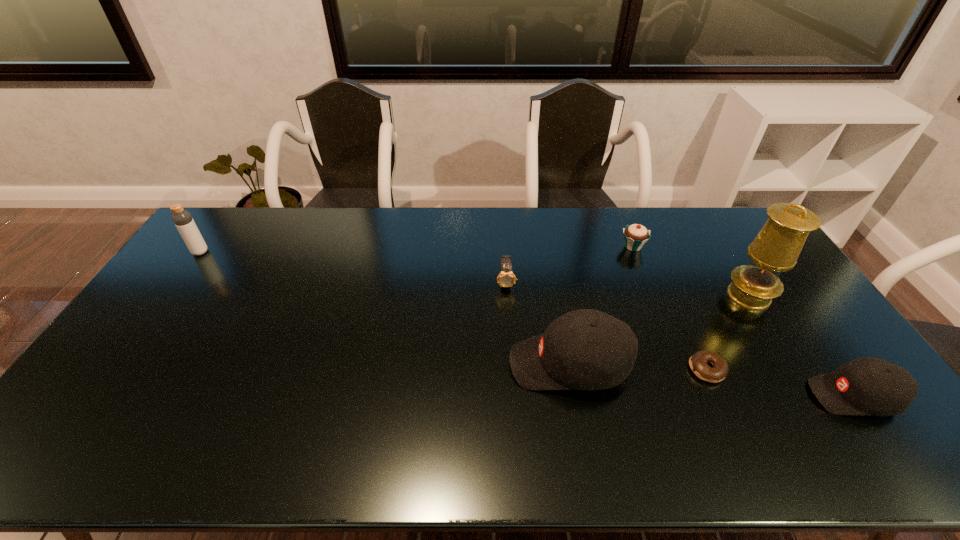
Find the location of a particular element. object that is at the far edge is located at coordinates (635, 235).

Identify the location of object at the left edge. The image size is (960, 540). (182, 219).

Find the location of a particular element. The image size is (960, 540). baseball cap that is at the right edge is located at coordinates (866, 386).

Where is `oil lamp situated at the right edge`? The image size is (960, 540). oil lamp situated at the right edge is located at coordinates (776, 248).

The height and width of the screenshot is (540, 960). In order to click on object that is at the near right corner in this screenshot , I will do `click(866, 386)`.

Locate an element on the screen. vacant space at the far edge is located at coordinates (656, 235).

Identify the location of blank space at the near edge. (249, 395).

You are a GUI agent. You are given a task and a screenshot of the screen. Output one action in this format:
    pyautogui.click(x=<x>, y=<y>)
    Task: Click on the vacant space at the left edge
    The width and height of the screenshot is (960, 540).
    Given the screenshot: What is the action you would take?
    pyautogui.click(x=130, y=342)

The image size is (960, 540). Find the location of `vacant region at the right edge of the desktop`. vacant region at the right edge of the desktop is located at coordinates (746, 247).

This screenshot has height=540, width=960. What are the coordinates of `free space at the far left corner` in the screenshot? It's located at (229, 218).